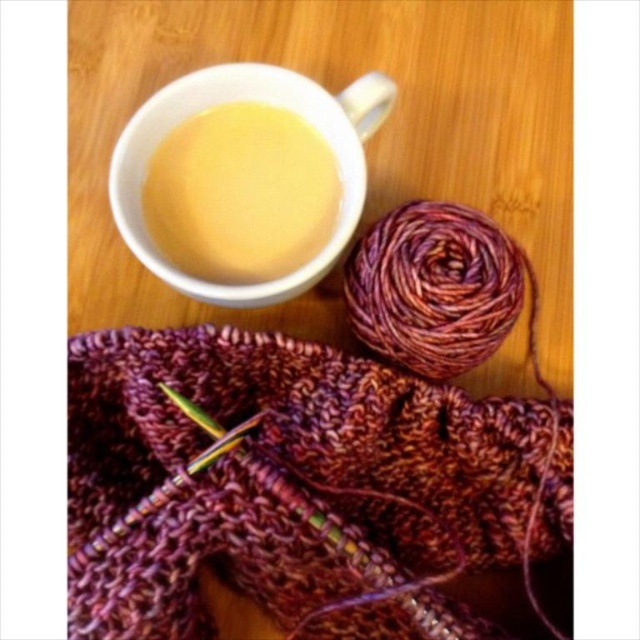
Question: Is knitted wool scarf at center bigger than yellow matte mug at upper center?

Choices:
 (A) no
 (B) yes

Answer: (B)

Question: Is knitted wool scarf at center thinner than yellow matte mug at upper center?

Choices:
 (A) yes
 (B) no

Answer: (B)

Question: Can you confirm if knitted wool scarf at center is thinner than yellow matte mug at upper center?

Choices:
 (A) no
 (B) yes

Answer: (A)

Question: Which point appears closest to the camera in this image?

Choices:
 (A) (276, 218)
 (B) (454, 404)

Answer: (B)